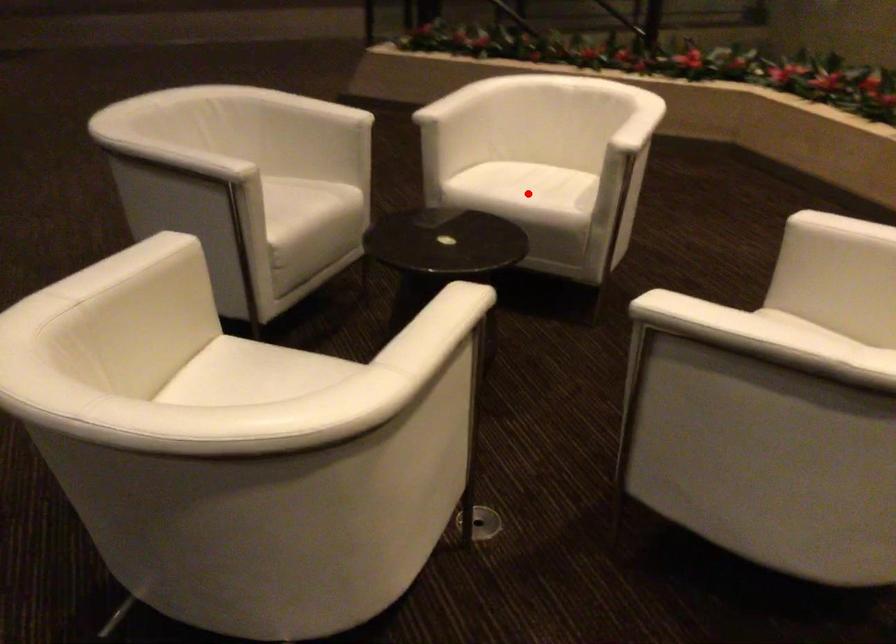
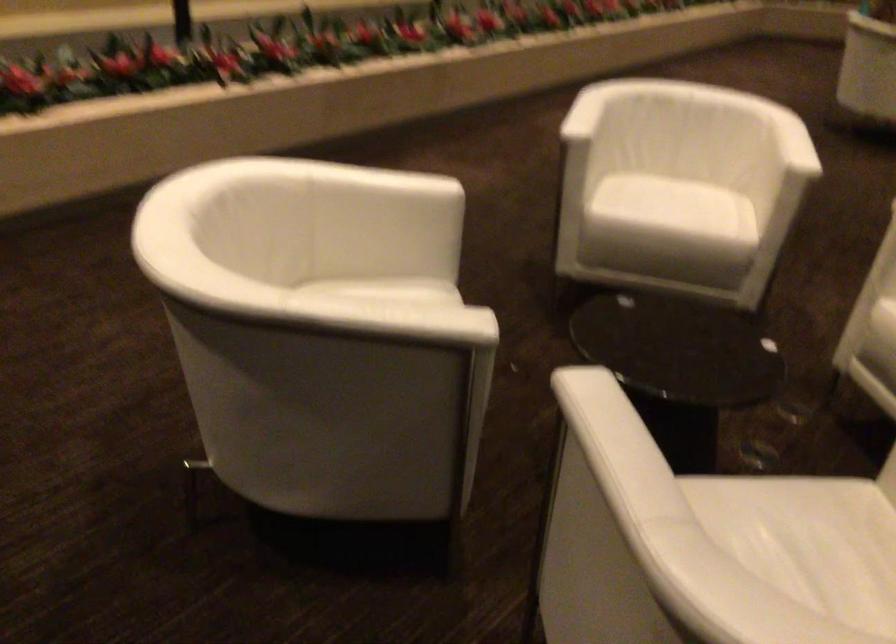
Question: I am providing you with two images of the same scene from different viewpoints. A red point is marked on the first image. Can you still see the location of the red point in image 2?

Choices:
 (A) Yes
 (B) No

Answer: (B)